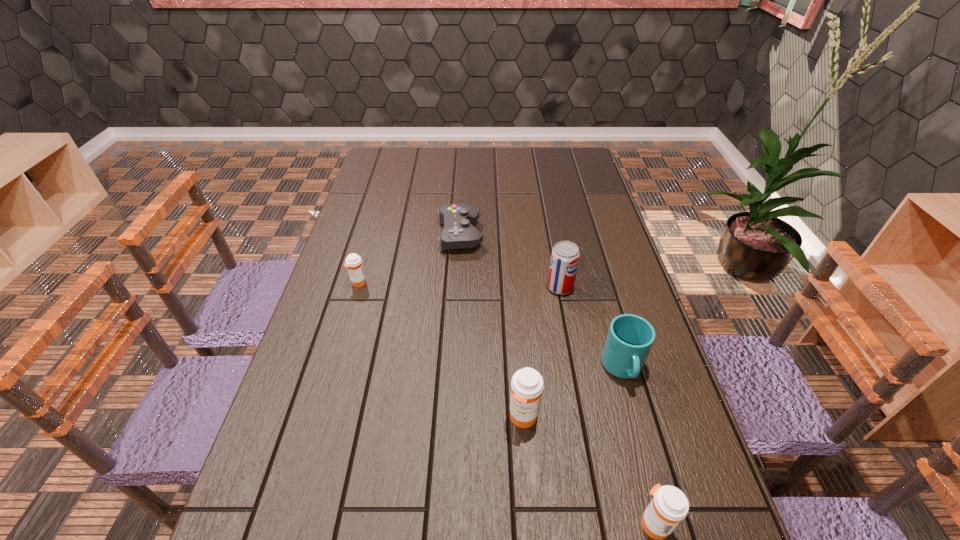
Please point a location where one more medicine can be added evenly. Please provide its 2D coordinates. Your answer should be formatted as a tuple, i.e. [(x, y)], where the tuple contains the x and y coordinates of a point satisfying the conditions above.

[(429, 341)]